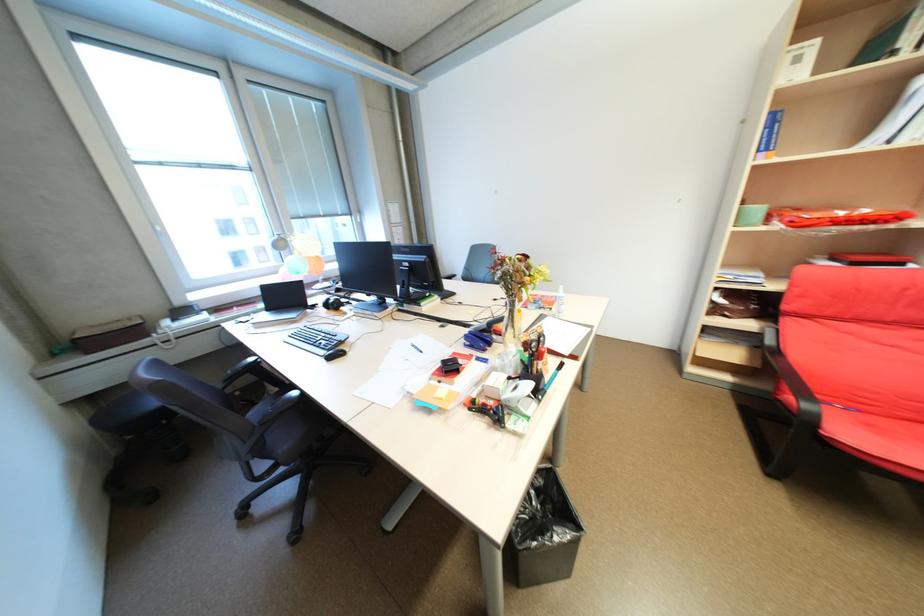
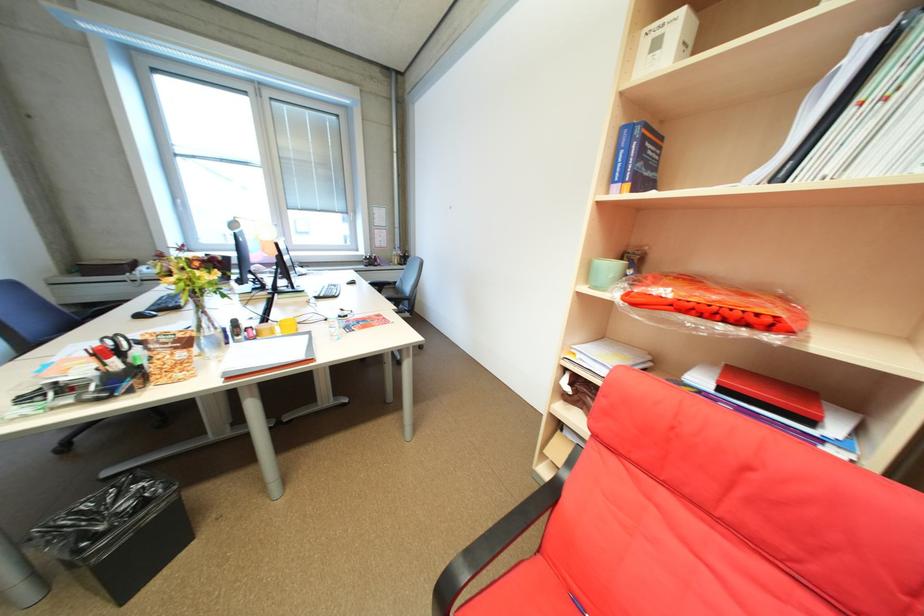
Question: In a continuous first-person perspective shot, in which direction is the camera moving?

Choices:
 (A) Left
 (B) Right
 (C) Forward
 (D) Backward

Answer: (B)